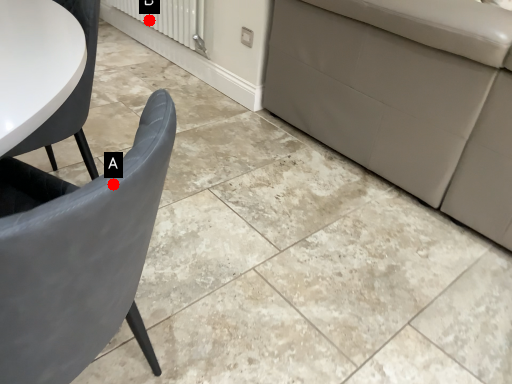
Question: Two points are circled on the image, labeled by A and B beside each circle. Which point is closer to the camera?

Choices:
 (A) A is closer
 (B) B is closer

Answer: (A)